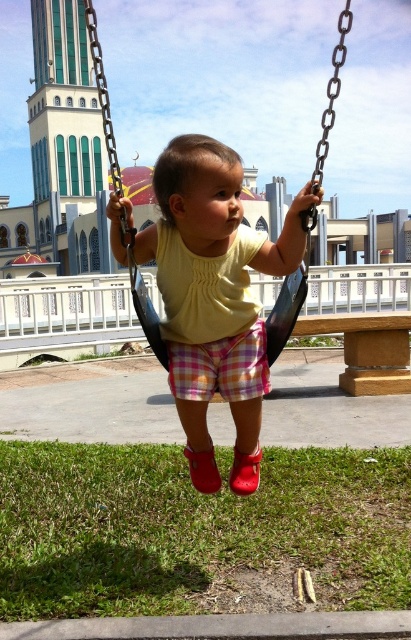
Who is shorter, yellow matte shirt at center or black plastic swing at center?

yellow matte shirt at center

What do you see at coordinates (214, 296) in the screenshot?
I see `yellow matte shirt at center` at bounding box center [214, 296].

The height and width of the screenshot is (640, 411). Describe the element at coordinates (214, 296) in the screenshot. I see `yellow matte shirt at center` at that location.

Image resolution: width=411 pixels, height=640 pixels. I want to click on yellow matte shirt at center, so click(214, 296).